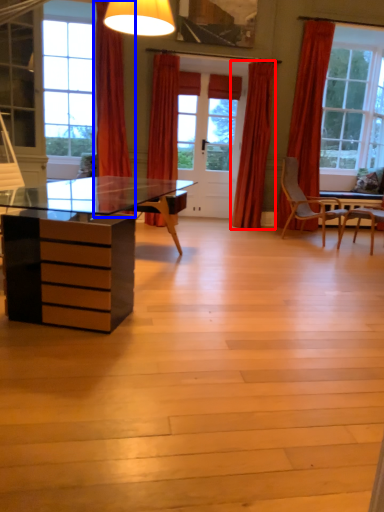
Question: Which of the following is the farthest to the observer, curtain (highlighted by a red box) or curtain (highlighted by a blue box)?

Choices:
 (A) curtain
 (B) curtain

Answer: (A)